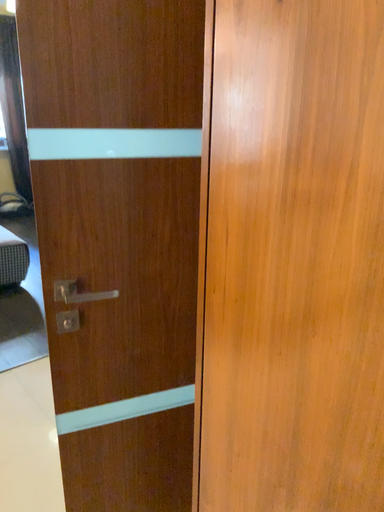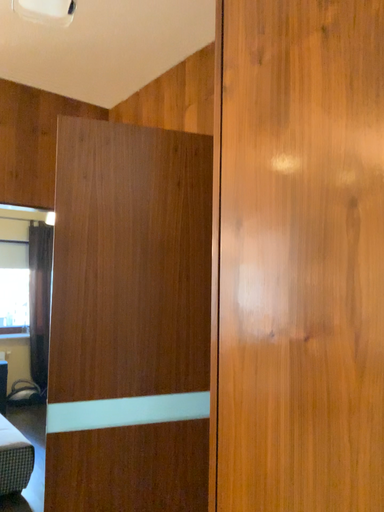
Question: How did the camera likely rotate when shooting the video?

Choices:
 (A) rotated upward
 (B) rotated downward

Answer: (A)